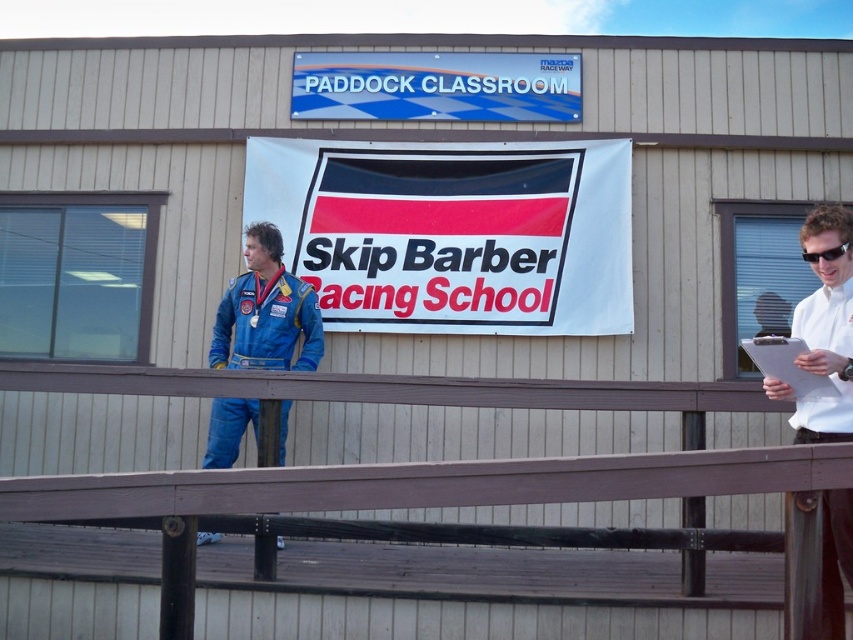
You are a photographer setting up equipment in front of the Paddock Classroom sign. You notice the white fabric banner at center and the white paper clipboard at right. Which object is wider?

The white fabric banner at center is wider than the white paper clipboard at right.

You are a photographer trying to capture both the white shirt at upper right and the faded denim jacket at lower left in a single frame. Given their sizes, which object should you focus on first to ensure both are clearly visible in your photo?

The white shirt at upper right is bigger than the faded denim jacket at lower left, so you should focus on the white shirt at upper right first to ensure it is in clear focus while the faded denim jacket at lower left will remain sharp due to its smaller size.

You are a photographer positioned at the center of the scene. You need to capture a photo that includes both the white shirt at upper right and the faded denim jacket at lower left. Based on their positions, which object should you adjust your camera angle to focus on first to ensure both are in frame?

The white shirt at upper right is located below the faded denim jacket at lower left. To capture both in the frame, you should first focus on the faded denim jacket at lower left, as it is higher up, ensuring the lower positioned white shirt at upper right remains within the camera view.